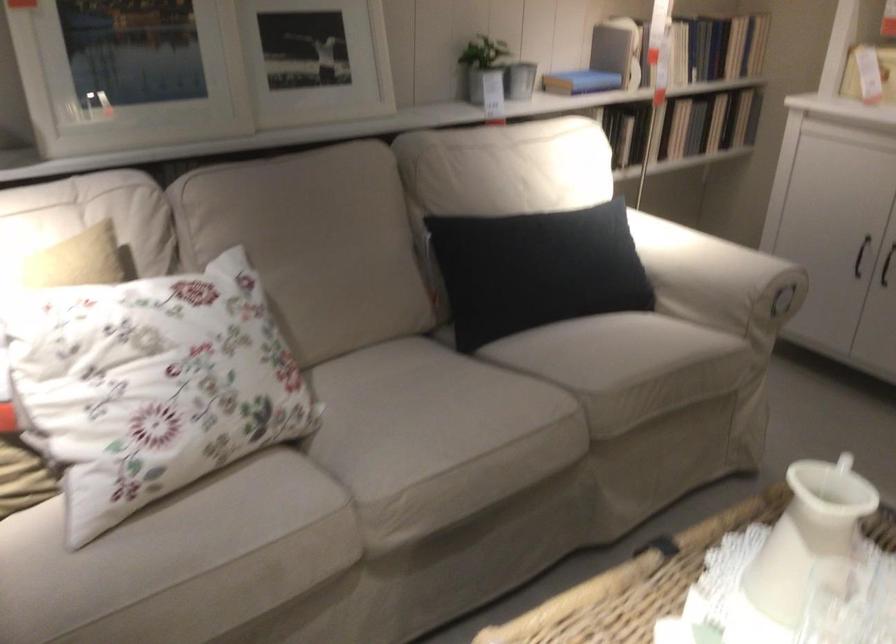
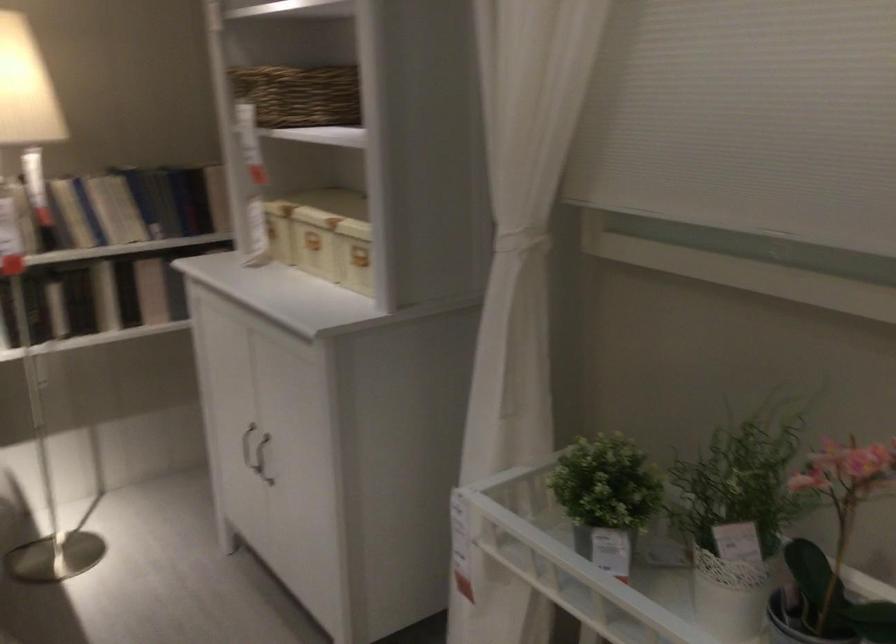
Question: I am providing you with two images of the same scene from different viewpoints. Please identify which objects are invisible in image2.

Choices:
 (A) green scissors
 (B) potted green plant
 (C) white cabinet handle
 (D) black cabinet handle

Answer: (D)